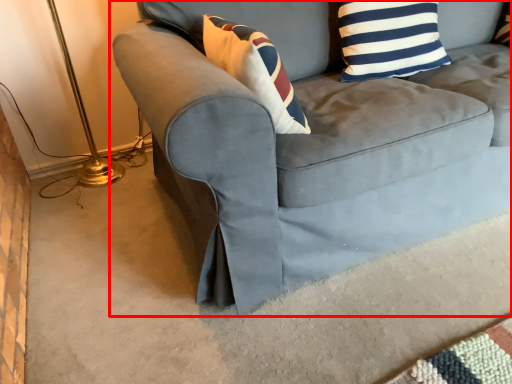
Question: In this image, where is studio couch (annotated by the red box) located relative to pillow?

Choices:
 (A) right
 (B) left

Answer: (A)